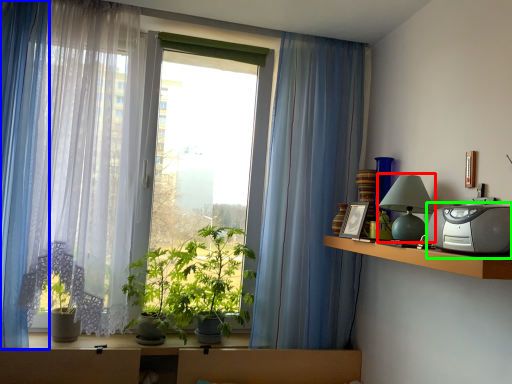
Question: Which is farther away from table lamp (highlighted by a red box)? curtain (highlighted by a blue box) or appliance (highlighted by a green box)?

Choices:
 (A) curtain
 (B) appliance

Answer: (A)